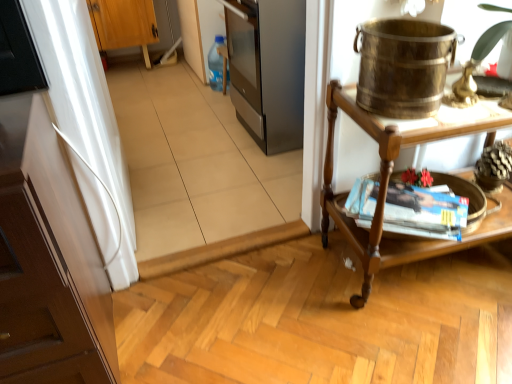
The image size is (512, 384). I want to click on vacant area in front of wooden table at right, so click(443, 329).